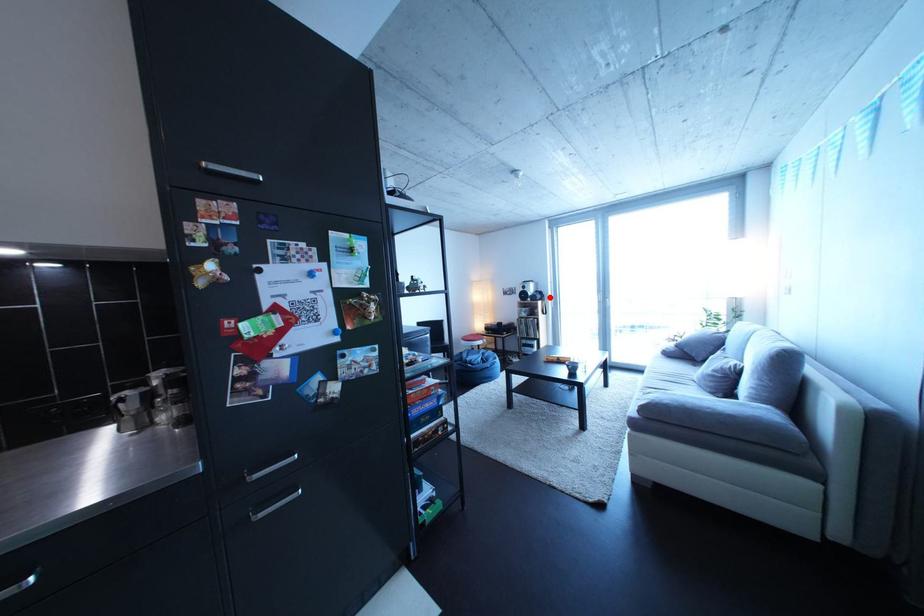
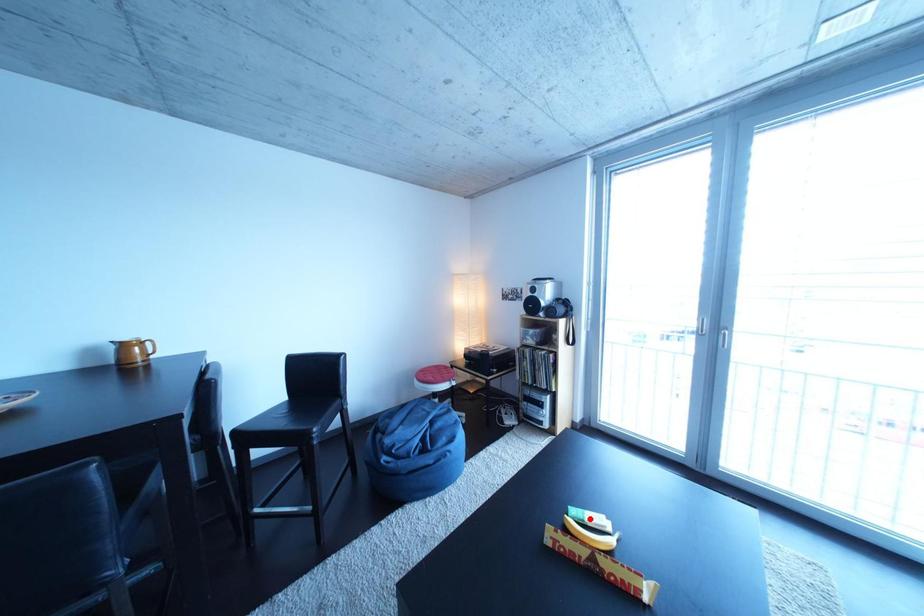
I am providing you with two images of the same scene from different viewpoints. A red point is marked on the first image and another point is marked on the second image. Do the highlighted points in image1 and image2 indicate the same real-world spot?

No